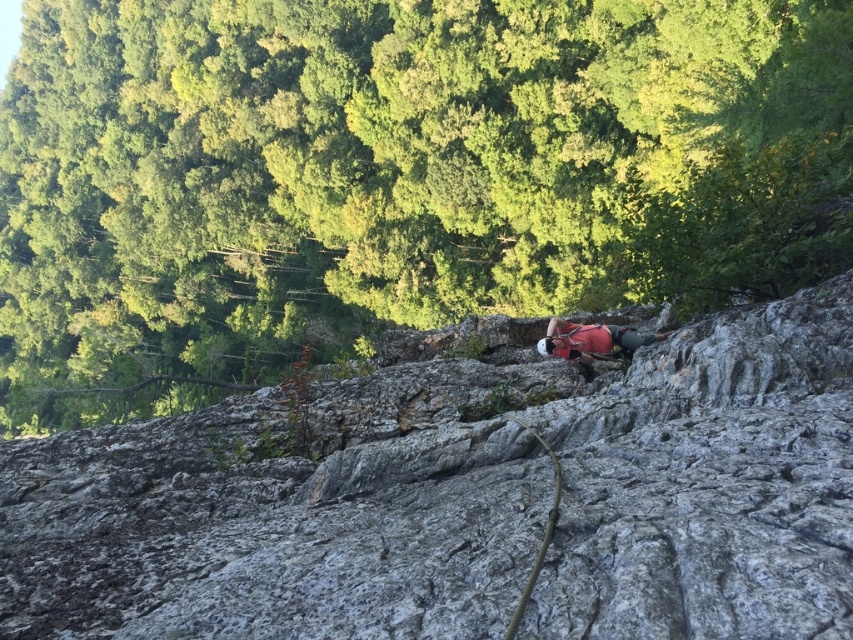
You are a rock climber who has reached the point at coordinates point (10, 108) and want to move towards the point at coordinates point (548, 328). Based on the scene description, will you need to move forward or backward to reach your destination?

Since point (10, 108) is behind point (548, 328), you will need to move forward to reach the destination point (548, 328) from your current position at point (10, 108).

You are a climber assessing the rock face. You notice two points marked on the rock face. The first point is at coordinates point (x=316, y=141) and the second is at point (x=407, y=340). Which point is closer to you?

Point (x=316, y=141) is closer to you because it is further to the viewer than point (x=407, y=340).